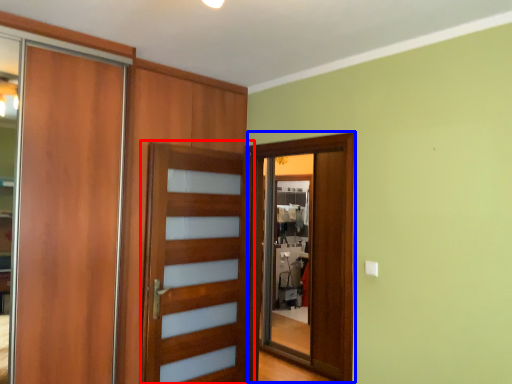
Question: Among these objects, which one is farthest to the camera, screen door (highlighted by a red box) or screen door (highlighted by a blue box)?

Choices:
 (A) screen door
 (B) screen door

Answer: (B)